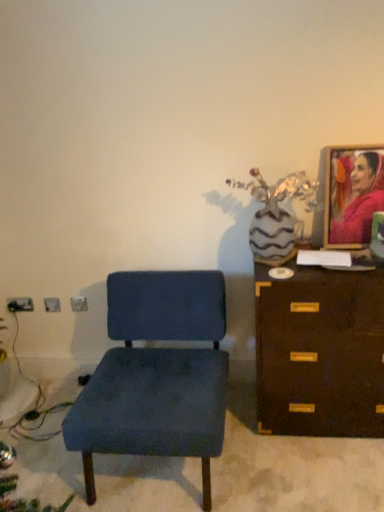
Where is `free space in front of brown wooden chest of drawers at right`? The image size is (384, 512). free space in front of brown wooden chest of drawers at right is located at coordinates (324, 471).